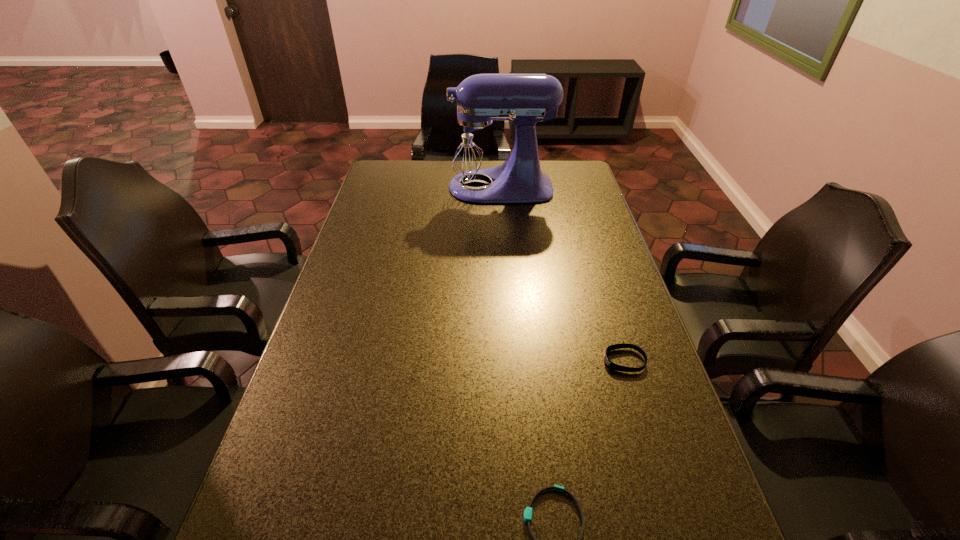
Image resolution: width=960 pixels, height=540 pixels. I want to click on object present at the far edge, so click(475, 146).

The height and width of the screenshot is (540, 960). I want to click on mixer at the right edge, so click(x=475, y=146).

The height and width of the screenshot is (540, 960). I want to click on wristband that is at the right edge, so click(x=611, y=365).

Where is `object that is at the far right corner`? Image resolution: width=960 pixels, height=540 pixels. object that is at the far right corner is located at coordinates (475, 146).

In the image, there is a desktop. At what (x,y) coordinates should I click in order to perform the action: click on free region at the left edge. Please return your answer as a coordinate pair (x, y). Looking at the image, I should click on (371, 210).

Where is `vacant space at the right edge of the desktop`? vacant space at the right edge of the desktop is located at coordinates (636, 434).

Find the location of `free space at the far left corner`. free space at the far left corner is located at coordinates (394, 165).

This screenshot has height=540, width=960. In order to click on blank region between the second farthest object and the tallest object in this screenshot , I will do `click(561, 274)`.

Locate an element on the screen. vacant space that's between the right wristband and the farthest object is located at coordinates 561,274.

The image size is (960, 540). Identify the location of free space between the taller wristband and the tallest object. (561, 274).